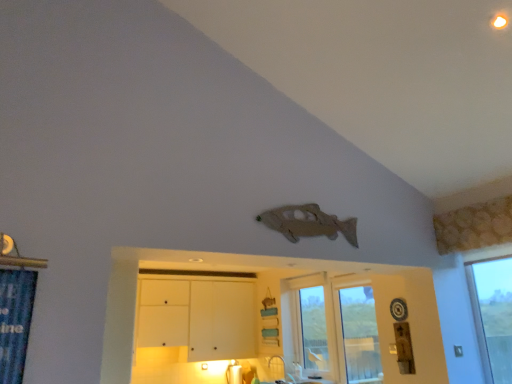
Question: In which direction should I rotate to look at transparent glass window at center, acting as the second window starting from the front?

Choices:
 (A) left
 (B) right

Answer: (B)

Question: Is transparent glass door at center, which is the first window in front-to-back order, looking in the opposite direction of transparent glass window at center, which appears as the first window when viewed from the back?

Choices:
 (A) yes
 (B) no

Answer: (B)

Question: Is transparent glass door at center, which is the first window in front-to-back order, next to transparent glass window at center, acting as the second window starting from the front, and touching it?

Choices:
 (A) no
 (B) yes

Answer: (B)

Question: Can you confirm if transparent glass door at center, the 2th window from the back, is positioned to the right of transparent glass window at center, acting as the second window starting from the front?

Choices:
 (A) no
 (B) yes

Answer: (B)

Question: Does transparent glass door at center, which is the first window in front-to-back order, appear on the left side of transparent glass window at center, which appears as the first window when viewed from the back?

Choices:
 (A) yes
 (B) no

Answer: (B)

Question: Does transparent glass door at center, the 2th window from the back, lie in front of transparent glass window at center, acting as the second window starting from the front?

Choices:
 (A) yes
 (B) no

Answer: (A)

Question: Does transparent glass door at center, the 2th window from the back, have a lesser height compared to transparent glass window at center, which appears as the first window when viewed from the back?

Choices:
 (A) no
 (B) yes

Answer: (B)

Question: Is the position of white matte cabinet at lower center, positioned as the 2th dresser in front-to-back order, less distant than that of transparent glass window at center, acting as the second window starting from the front?

Choices:
 (A) no
 (B) yes

Answer: (A)

Question: Considering the relative sizes of white matte cabinet at lower center, positioned as the 2th dresser in front-to-back order, and transparent glass window at center, acting as the second window starting from the front, in the image provided, is white matte cabinet at lower center, positioned as the 2th dresser in front-to-back order, wider than transparent glass window at center, acting as the second window starting from the front,?

Choices:
 (A) yes
 (B) no

Answer: (A)

Question: Is there a large distance between white matte cabinet at lower center, positioned as the 2th dresser in front-to-back order, and transparent glass window at center, which appears as the first window when viewed from the back?

Choices:
 (A) no
 (B) yes

Answer: (B)

Question: From the image's perspective, is white matte cabinet at lower center, which is counted as the 1th dresser, starting from the back, under transparent glass window at center, acting as the second window starting from the front?

Choices:
 (A) yes
 (B) no

Answer: (A)

Question: From a real-world perspective, is white matte cabinet at lower center, positioned as the 2th dresser in front-to-back order, over transparent glass window at center, which appears as the first window when viewed from the back?

Choices:
 (A) no
 (B) yes

Answer: (B)

Question: Is the depth of white matte cabinet at lower center, positioned as the 2th dresser in front-to-back order, greater than that of transparent glass window at center, which appears as the first window when viewed from the back?

Choices:
 (A) no
 (B) yes

Answer: (B)

Question: From a real-world perspective, does white matte cabinet at lower center, which is counted as the 1th dresser, starting from the back, sit lower than wooden fish at upper center, marked as the second dresser in a back-to-front arrangement?

Choices:
 (A) no
 (B) yes

Answer: (A)